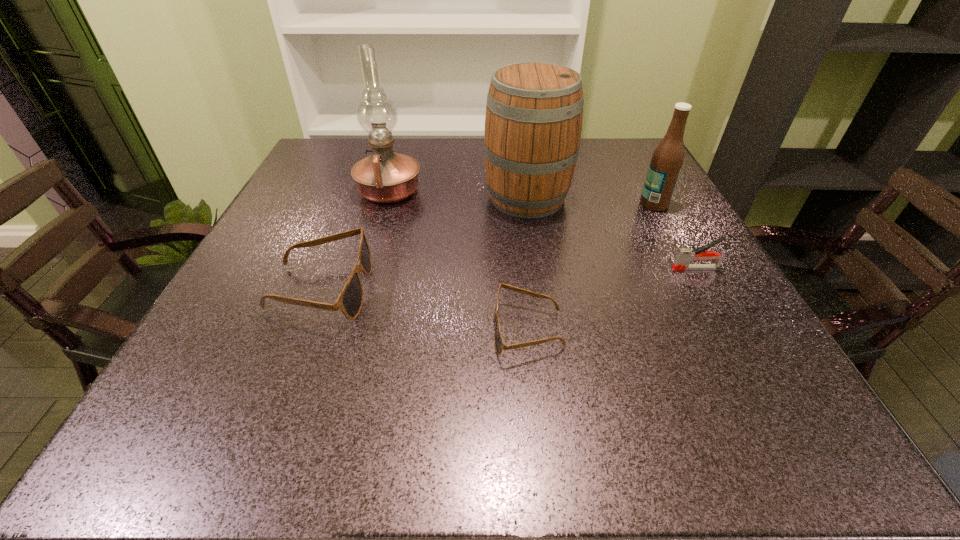
Locate an element on the screen. The width and height of the screenshot is (960, 540). vacant space located on the frames of the right sunglasses is located at coordinates (345, 330).

Locate an element on the screen. free point located on the right of the cider is located at coordinates (654, 197).

This screenshot has width=960, height=540. I want to click on free space located on the front of the oil lamp, so click(x=372, y=251).

Where is `free space located 0.160m on the front of the third tallest object`? The height and width of the screenshot is (540, 960). free space located 0.160m on the front of the third tallest object is located at coordinates (683, 256).

Locate an element on the screen. The image size is (960, 540). vacant space located 0.350m on the handle side of the stapler is located at coordinates (492, 268).

Find the location of a particular element. The height and width of the screenshot is (540, 960). free space located 0.240m on the handle side of the stapler is located at coordinates (549, 268).

The height and width of the screenshot is (540, 960). What are the coordinates of `free region located 0.180m on the handle side of the stapler` in the screenshot? It's located at (580, 268).

Find the location of `cider that is at the far edge`. cider that is at the far edge is located at coordinates (533, 123).

Locate an element on the screen. The width and height of the screenshot is (960, 540). oil lamp present at the far edge is located at coordinates (385, 176).

Identify the location of object positioned at the near edge. (499, 344).